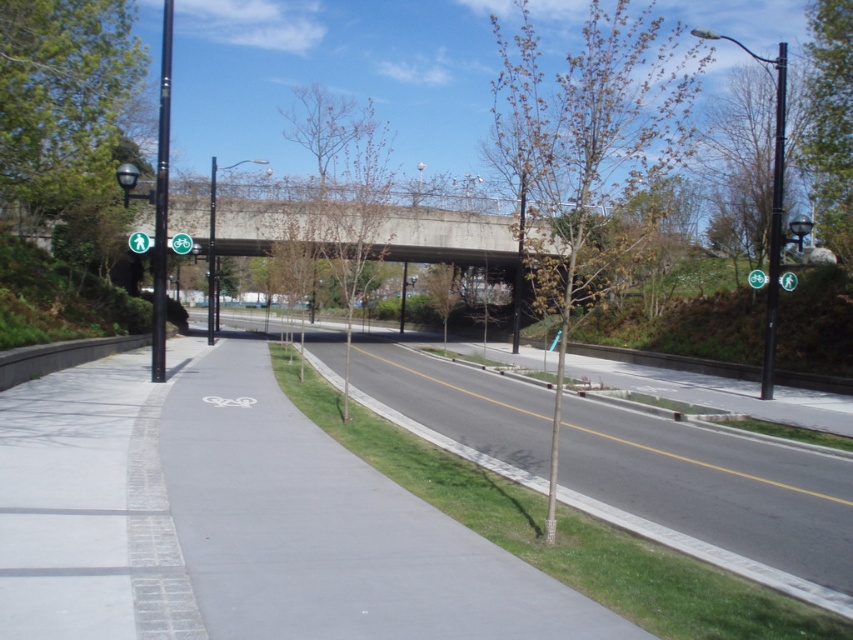
You are standing at the point marked by the white bicycle symbol on the pavement. Looking towards the metallic pole at center, which direction should you face? The metallic pole at center is located at point (518, 268). Since the pole is at the center, facing it from the bicycle symbol would require facing north. However, the exact direction depends on the coordinate system used in the image. Without additional information about the coordinate system orientation, it is impossible to determine the exact.

The metallic pole at center is located at point (518, 268). Since the pole is at the center, facing it from the bicycle symbol would require facing north. However, the exact direction depends on the coordinate system used in the image. Without additional information about the coordinate system orientation, it is impossible to determine the exact direction to face.

You are a delivery robot navigating the urban pathway. You need to move from your current position to the delivery point located at point (518, 291). However, there is an obstacle at point (178, 234). Will you have to go around the obstacle before reaching your destination?

Point (518, 291) is behind point (178, 234), so yes, you will have to go around the obstacle at point (178, 234) before reaching your destination.